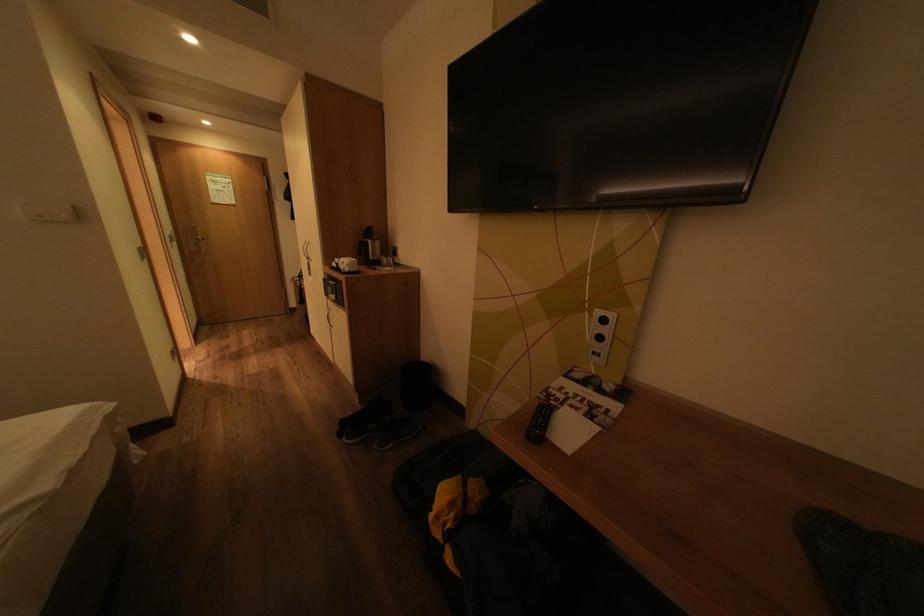
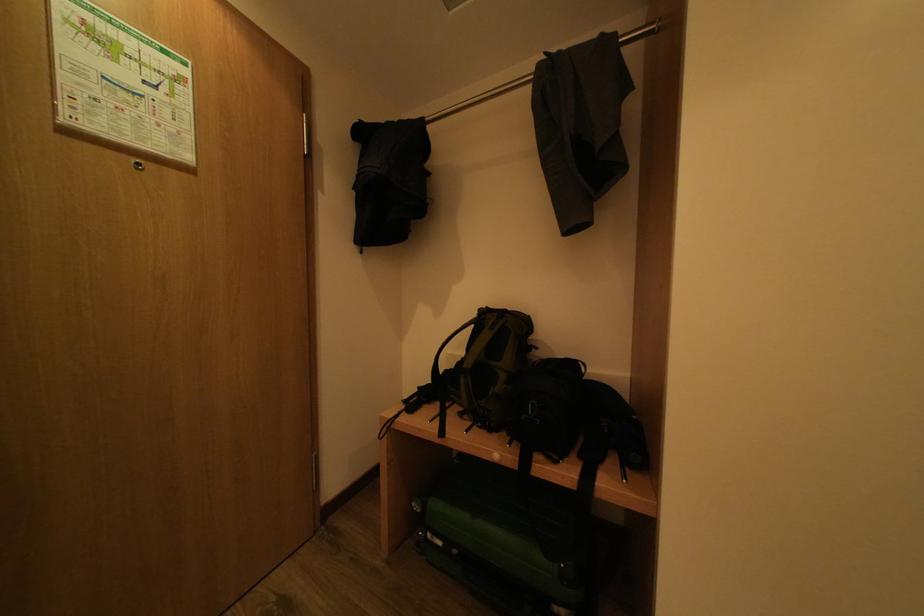
What movement of the cameraman would produce the second image?

The cameraman walked toward left, forward.